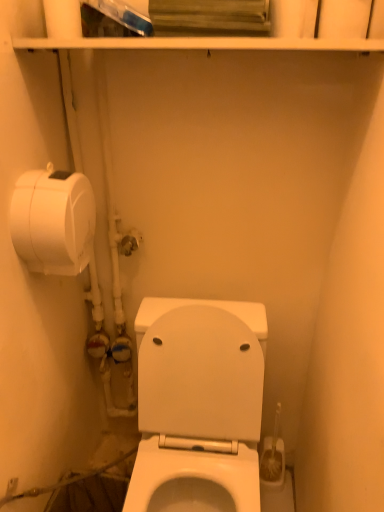
Where is `white glossy toilet at center`? The width and height of the screenshot is (384, 512). white glossy toilet at center is located at coordinates (199, 411).

Measure the distance between point (216, 341) and camera.

Point (216, 341) is 3.85 feet from camera.

The width and height of the screenshot is (384, 512). What do you see at coordinates (199, 411) in the screenshot?
I see `white glossy toilet at center` at bounding box center [199, 411].

Describe the element at coordinates (53, 221) in the screenshot. I see `white matte toilet paper at left` at that location.

Image resolution: width=384 pixels, height=512 pixels. Identify the location of white matte toilet paper at left. (53, 221).

Locate an element on the screen. The height and width of the screenshot is (512, 384). white glossy toilet at center is located at coordinates (199, 411).

Considering the relative positions of white matte toilet paper at left and white glossy toilet at center in the image provided, is white matte toilet paper at left to the left of white glossy toilet at center from the viewer's perspective?

Yes, white matte toilet paper at left is to the left of white glossy toilet at center.

Between white matte toilet paper at left and white glossy toilet at center, which one is positioned in front?

white glossy toilet at center.

Which is less distant, (24, 250) or (217, 361)?

Point (24, 250) is positioned closer to the camera compared to point (217, 361).

From the image's perspective, who appears lower, white matte toilet paper at left or white glossy toilet at center?

white glossy toilet at center.

In the scene shown: From a real-world perspective, between white matte toilet paper at left and white glossy toilet at center, who is vertically lower?

From a 3D spatial view, white glossy toilet at center is below.

Which object is wider, white matte toilet paper at left or white glossy toilet at center?

white glossy toilet at center is wider.

Which of these two, white matte toilet paper at left or white glossy toilet at center, stands taller?

white glossy toilet at center is taller.

Can you confirm if white matte toilet paper at left is smaller than white glossy toilet at center?

Correct, white matte toilet paper at left occupies less space than white glossy toilet at center.

Is white matte toilet paper at left not within white glossy toilet at center?

Yes, white matte toilet paper at left is outside of white glossy toilet at center.

Is white matte toilet paper at left far from white glossy toilet at center?

white matte toilet paper at left is near white glossy toilet at center, not far away.

Is white matte toilet paper at left aimed at white glossy toilet at center?

No.

How different are the orientations of white matte toilet paper at left and white glossy toilet at center in degrees?

The facing directions of white matte toilet paper at left and white glossy toilet at center are 91.1 degrees apart.

How distant is white matte toilet paper at left from white glossy toilet at center?

white matte toilet paper at left is 19.02 inches from white glossy toilet at center.

The width and height of the screenshot is (384, 512). What are the coordinates of `toilet paper above the white glossy toilet at center (from the image's perspective)` in the screenshot? It's located at (53, 221).

From the picture: Can you confirm if white glossy toilet at center is positioned to the right of white matte toilet paper at left?

Yes, white glossy toilet at center is to the right of white matte toilet paper at left.

Is white glossy toilet at center in front of or behind white matte toilet paper at left in the image?

white glossy toilet at center is positioned closer to the viewer than white matte toilet paper at left.

Considering the points (181, 464) and (68, 247), which point is behind, point (181, 464) or point (68, 247)?

The point (181, 464) is farther.

Based on the photo, from the image's perspective, is white glossy toilet at center under white matte toilet paper at left?

Yes, from the image's perspective, white glossy toilet at center is beneath white matte toilet paper at left.

From a real-world perspective, is white glossy toilet at center above or below white matte toilet paper at left?

white glossy toilet at center is situated lower than white matte toilet paper at left in the real world.

Between white glossy toilet at center and white matte toilet paper at left, which one has smaller width?

white matte toilet paper at left is thinner.

Which of these two, white glossy toilet at center or white matte toilet paper at left, stands taller?

white glossy toilet at center is taller.

Considering the sizes of objects white glossy toilet at center and white matte toilet paper at left in the image provided, who is bigger, white glossy toilet at center or white matte toilet paper at left?

white glossy toilet at center.

Is white glossy toilet at center inside the boundaries of white matte toilet paper at left, or outside?

The correct answer is: outside.

Is white glossy toilet at center touching white matte toilet paper at left?

No, white glossy toilet at center is not beside white matte toilet paper at left.

Is white matte toilet paper at left at the back of white glossy toilet at center?

No.

Can you tell me how much white glossy toilet at center and white matte toilet paper at left differ in facing direction?

They differ by 91.1 degrees in their facing directions.

How distant is white glossy toilet at center from white matte toilet paper at left?

white glossy toilet at center is 19.02 inches from white matte toilet paper at left.

Identify the location of toilet in front of the white matte toilet paper at left. (199, 411).

Locate an element on the screen. The height and width of the screenshot is (512, 384). toilet paper above the white glossy toilet at center (from the image's perspective) is located at coordinates (53, 221).

You are a GUI agent. You are given a task and a screenshot of the screen. Output one action in this format:
    pyautogui.click(x=<x>, y=<y>)
    Task: Click on the toilet located on the right of white matte toilet paper at left
    
    Given the screenshot: What is the action you would take?
    pyautogui.click(x=199, y=411)